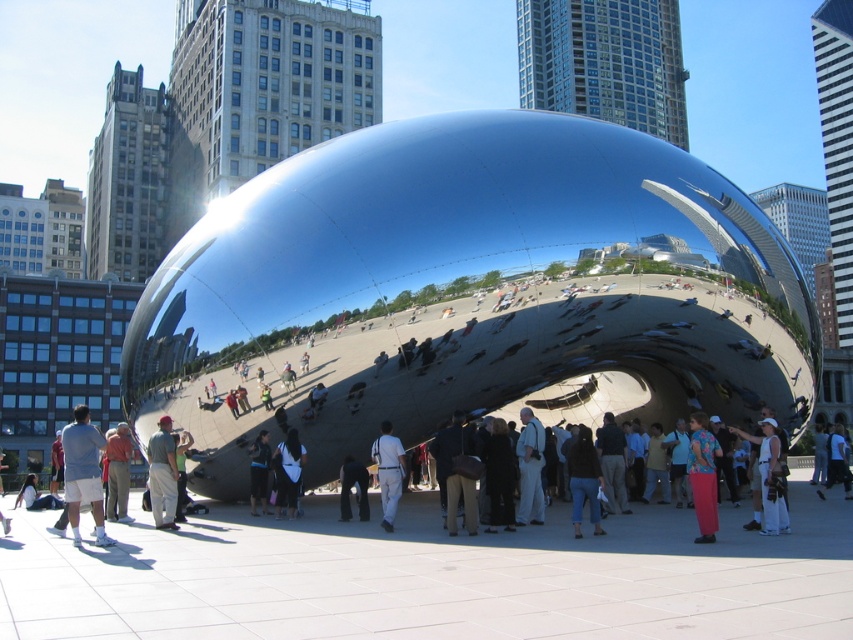
Consider the image. You are a photographer planning to capture a group photo of the two people wearing the gray cotton shirt at lower left and white cotton shirt at lower right. Considering their shirt widths, which person should you position closer to the camera to ensure both appear equally sized in the photo?

You should position the person wearing the gray cotton shirt at lower left closer to the camera since their shirt is narrower than the white cotton shirt at lower right. This adjustment will help balance their apparent sizes in the photo.

You are standing at the base of the Cloud Gate sculpture and want to take a photo that includes both the point at coordinates point [103,524] and point [840,464]. Which point should you focus on first to ensure both are in the frame?

You should focus on point [103,524] first because it is closer to you than point [840,464], ensuring both points are within the camera frame.

You are standing at the entrance of Millennium Park and want to locate the person wearing light gray pants at center. According to the coordinates provided, where should you look to find them?

The person wearing light gray pants at center is located at coordinates point (531, 468).